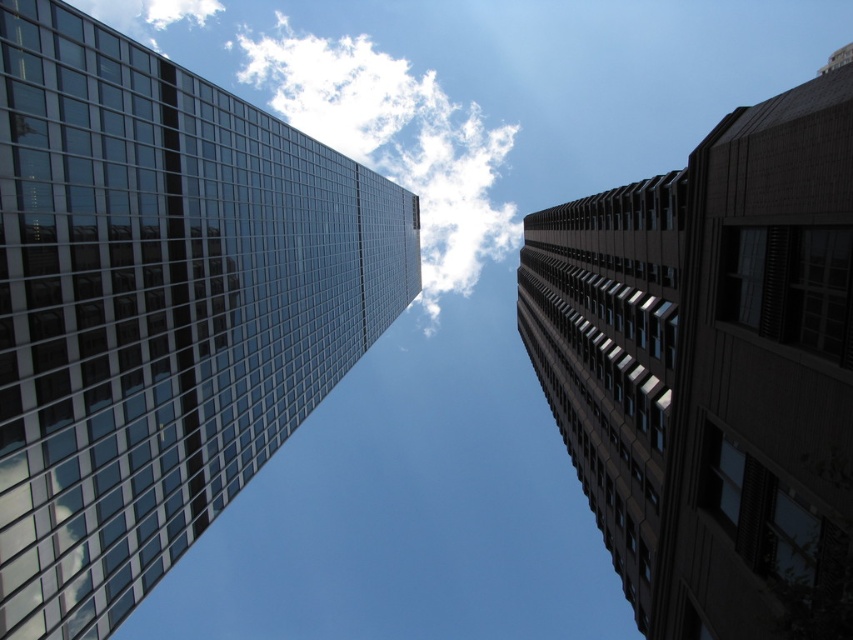
You are a drone operator trying to fly your drone between the brown brick building at upper right and the white fluffy cloud at upper center. Based on their heights, can your drone safely pass through the space between them?

The brown brick building at upper right has a lesser height compared to the white fluffy cloud at upper center, so the drone can safely pass through the space between them as there is enough vertical clearance.

You are an architect analyzing the image of two skyscrapers. You notice the glassy reflective skyscraper at left and the white fluffy cloud at upper center. Which one appears taller in the image?

The glassy reflective skyscraper at left is shorter than the white fluffy cloud at upper center, so the cloud appears taller in the image.

You are standing at the base of the glassy reflective skyscraper at left. Looking up, you notice its reflection in the glass. Where in the sky would the actual clouds be located relative to the reflection you see in the glass?

The actual clouds in the sky would be located at the same position as their reflection in the glassy reflective skyscraper at left, but mirrored vertically.